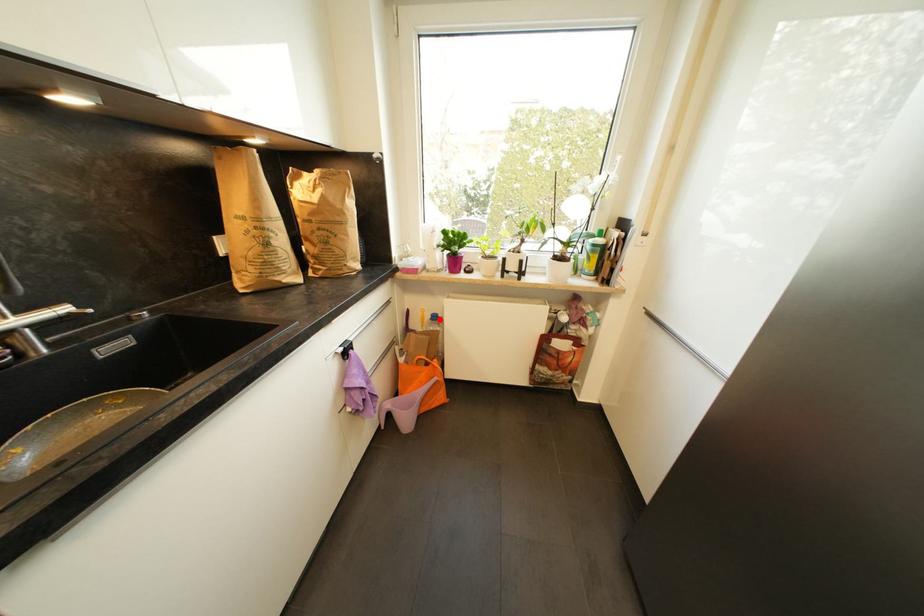
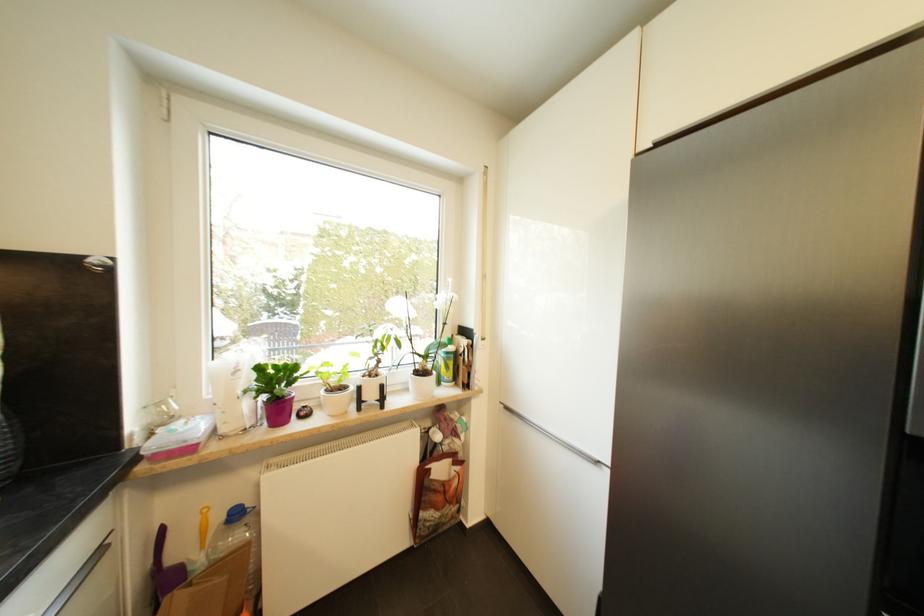
Question: I am providing you with two images of the same scene from different viewpoints. In image1, a red point is highlighted. Considering the same 3D point in image2, which of the following is correct?

Choices:
 (A) It is closer
 (B) It is farther

Answer: (B)